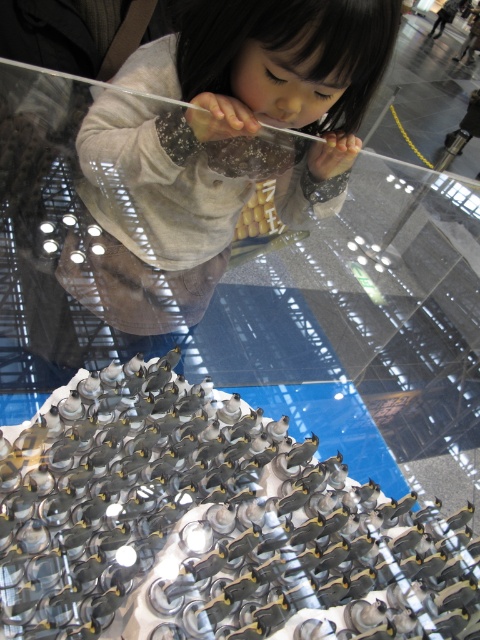
Does metallic silver sculpture at center come behind matte gray hoodie at upper center?

Yes, it is behind matte gray hoodie at upper center.

Between point (319, 513) and point (199, 218), which one is positioned behind?

Positioned behind is point (199, 218).

The width and height of the screenshot is (480, 640). What do you see at coordinates (211, 525) in the screenshot? I see `metallic silver sculpture at center` at bounding box center [211, 525].

Find the location of `metallic silver sculpture at center`. metallic silver sculpture at center is located at coordinates click(211, 525).